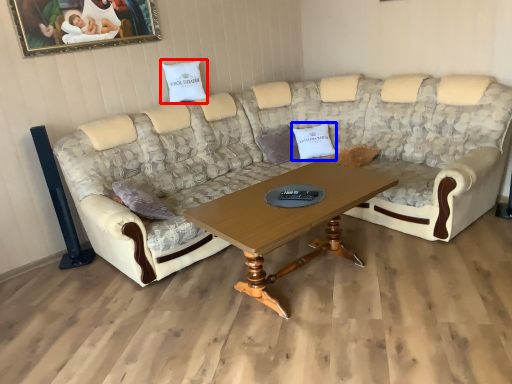
Question: Among these objects, which one is nearest to the camera, pillow (highlighted by a red box) or pillow (highlighted by a blue box)?

Choices:
 (A) pillow
 (B) pillow

Answer: (A)